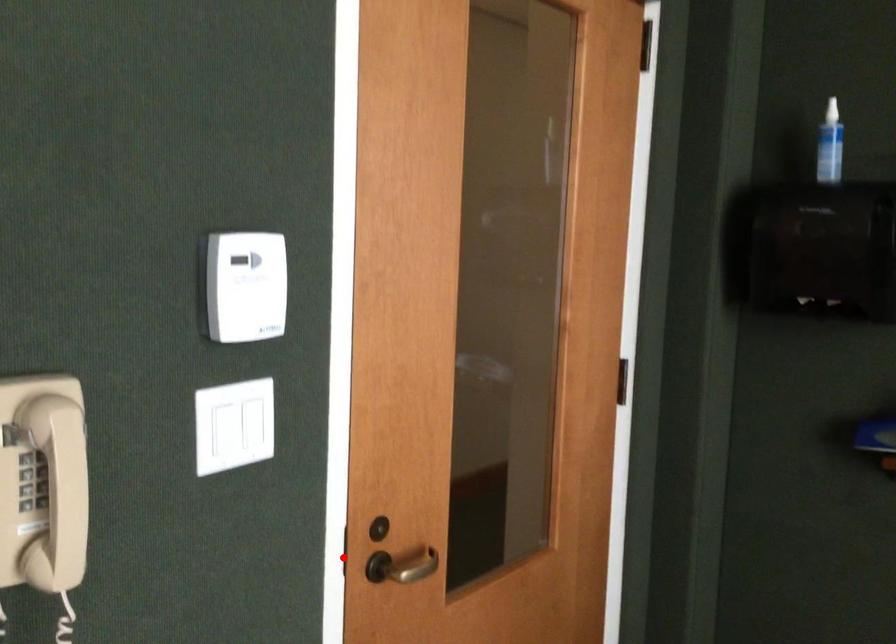
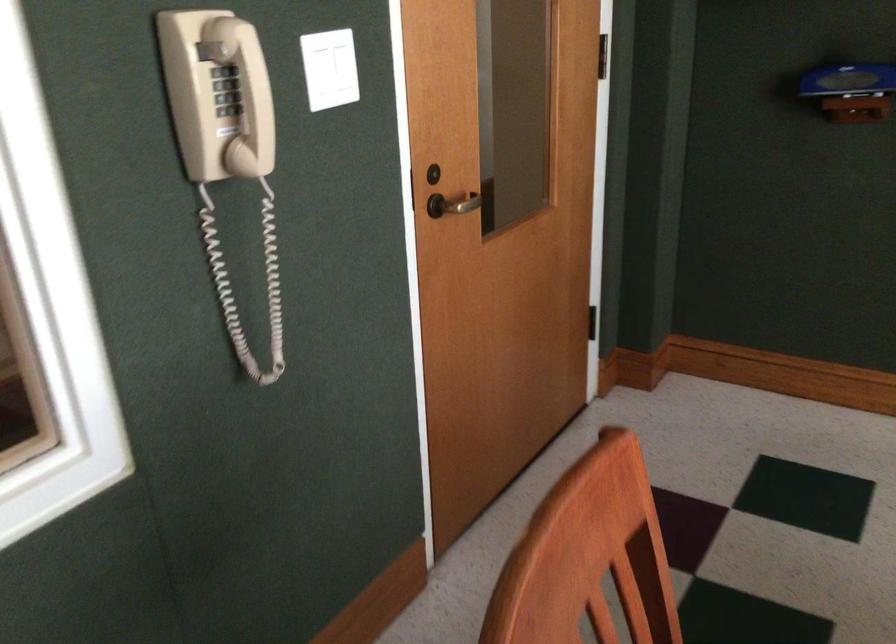
Where in the second image is the point corresponding to the highlighted location from the first image?

(409, 191)